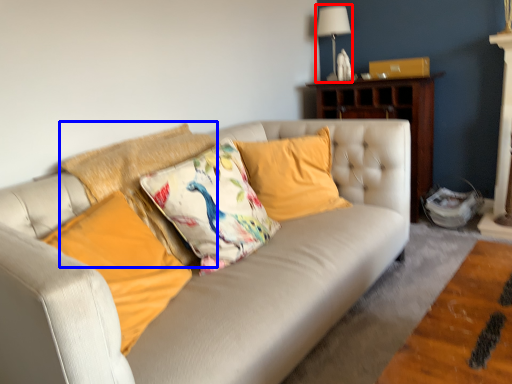
Question: Among these objects, which one is farthest to the camera, lamp (highlighted by a red box) or pillow (highlighted by a blue box)?

Choices:
 (A) lamp
 (B) pillow

Answer: (A)